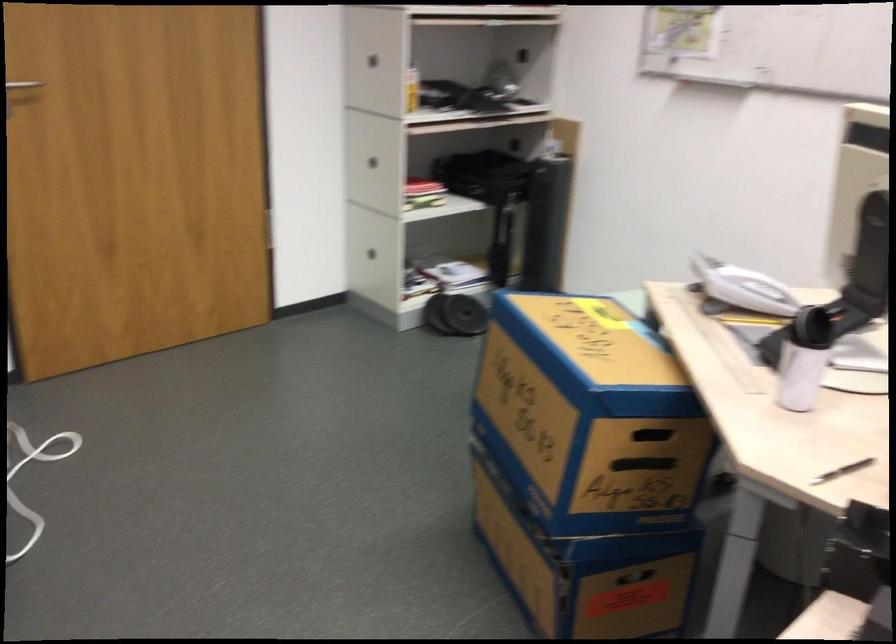
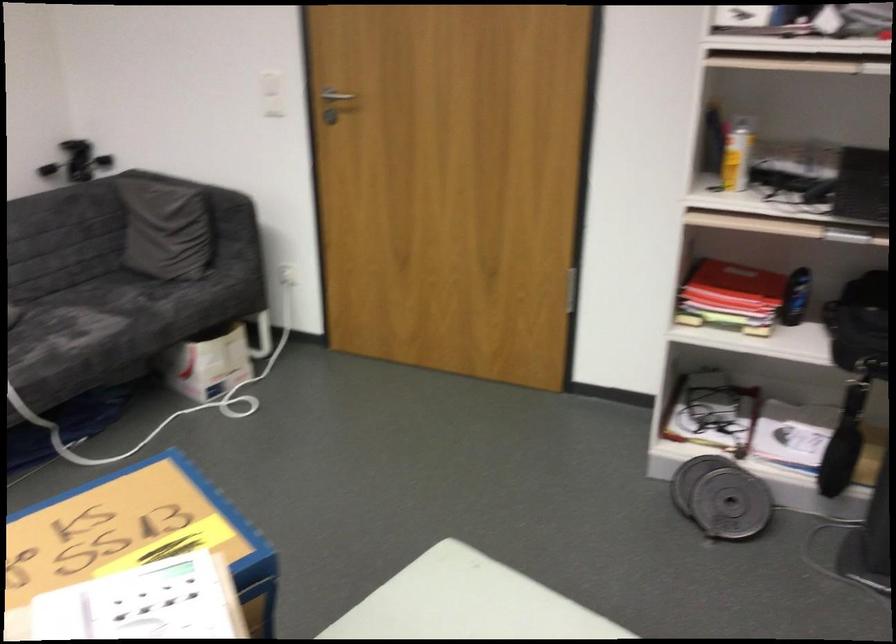
Where in the second image is the point corresponding to [561,315] from the first image?

(139, 535)